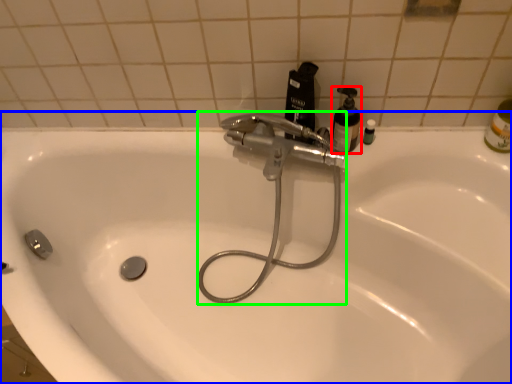
Question: Estimate the real-world distances between objects in this image. Which object is closer to mouthwash (highlighted by a red box), sink (highlighted by a blue box) or plumbing fixture (highlighted by a green box)?

Choices:
 (A) sink
 (B) plumbing fixture

Answer: (B)